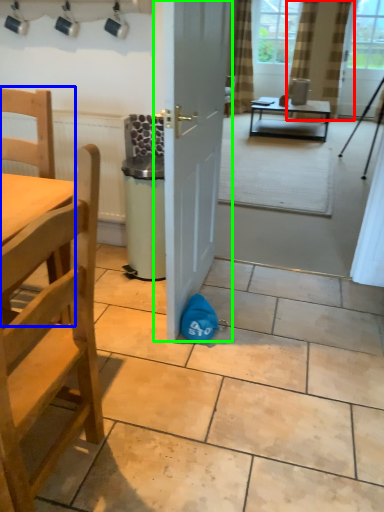
Question: Based on their relative distances, which object is farther from curtain (highlighted by a red box)? Choose from chair (highlighted by a blue box) and door (highlighted by a green box).

Choices:
 (A) chair
 (B) door

Answer: (A)